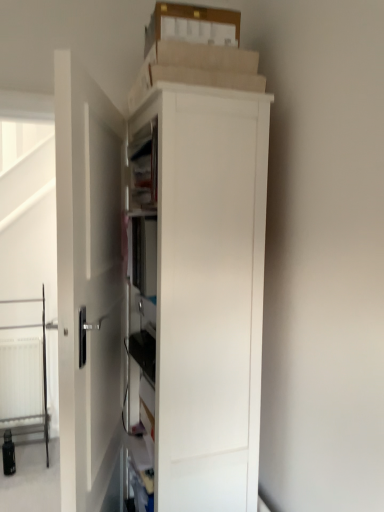
Question: Is point click(x=16, y=251) positioned closer to the camera than point click(x=69, y=348)?

Choices:
 (A) farther
 (B) closer

Answer: (A)

Question: In terms of height, does transparent glass screen door at left look taller or shorter compared to white smooth door at center?

Choices:
 (A) short
 (B) tall

Answer: (B)

Question: Based on their relative distances, which object is nearer to the white matte cabinet at center?

Choices:
 (A) white smooth door at center
 (B) transparent glass screen door at left
 (C) white plastic radiator at lower left

Answer: (A)

Question: Estimate the real-world distances between objects in this image. Which object is closer to the white matte cabinet at center?

Choices:
 (A) white smooth door at center
 (B) transparent glass screen door at left
 (C) white plastic radiator at lower left

Answer: (A)